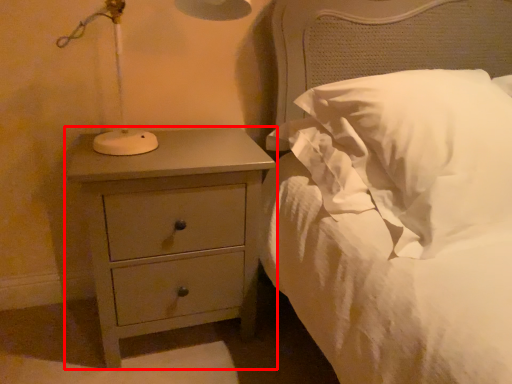
Question: From the image's perspective, where is chest of drawers (annotated by the red box) located relative to pillow?

Choices:
 (A) below
 (B) above

Answer: (A)